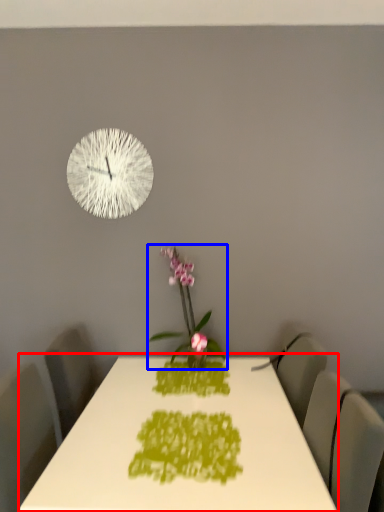
Question: Among these objects, which one is farthest to the camera, table (highlighted by a red box) or houseplant (highlighted by a blue box)?

Choices:
 (A) table
 (B) houseplant

Answer: (B)